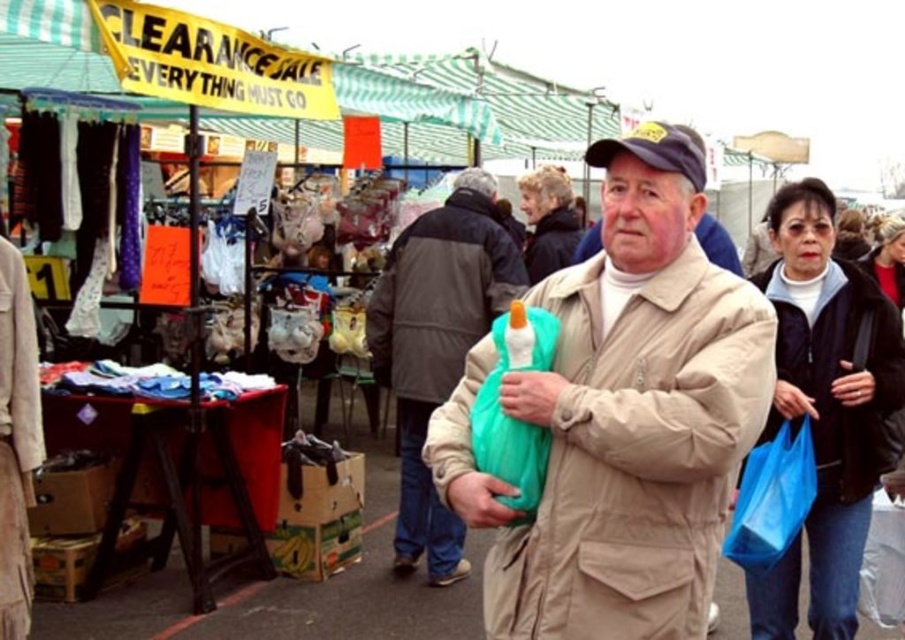
Can you confirm if tan matte trench coat at center is positioned to the right of matte plastic bag at center?

Correct, you'll find tan matte trench coat at center to the right of matte plastic bag at center.

Locate an element on the screen. The width and height of the screenshot is (905, 640). tan matte trench coat at center is located at coordinates (634, 413).